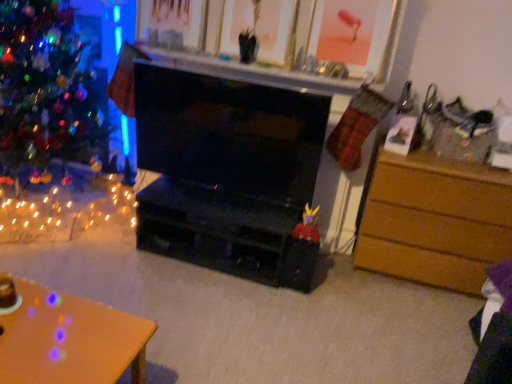
Where is `orange wood desk at lower left`? This screenshot has height=384, width=512. orange wood desk at lower left is located at coordinates (70, 340).

In order to click on black glossy fireplace at center in this screenshot , I will do `click(229, 133)`.

Describe the element at coordinates (47, 88) in the screenshot. I see `shiny multicolored ornaments at left` at that location.

Locate an element on the screen. Image resolution: width=512 pixels, height=384 pixels. orange wood desk at lower left is located at coordinates (70, 340).

In the scene shown: Does orange wood desk at lower left lie behind black glossy fireplace at center?

No, orange wood desk at lower left is in front of black glossy fireplace at center.

Is orange wood desk at lower left directly adjacent to black glossy fireplace at center?

No, orange wood desk at lower left is not next to black glossy fireplace at center.

Do you think orange wood desk at lower left is within black glossy fireplace at center, or outside of it?

orange wood desk at lower left is not enclosed by black glossy fireplace at center.

The width and height of the screenshot is (512, 384). What are the coordinates of `desk below the black glossy fireplace at center (from a real-world perspective)` in the screenshot? It's located at (70, 340).

Between point (438, 274) and point (148, 115), which one is positioned in front?

Point (148, 115)

From the image's perspective, which is below, brown wooden chest of drawers at right or black glossy fireplace at center?

brown wooden chest of drawers at right.

Which is more to the left, brown wooden chest of drawers at right or black glossy fireplace at center?

black glossy fireplace at center.

Can we say brown wooden chest of drawers at right lies outside black glossy fireplace at center?

brown wooden chest of drawers at right lies outside black glossy fireplace at center's area.

Identify the location of fireplace above the shiny multicolored ornaments at left (from a real-world perspective). This screenshot has width=512, height=384. (229, 133).

In the scene shown: Who is smaller, black glossy fireplace at center or shiny multicolored ornaments at left?

With smaller size is black glossy fireplace at center.

Does black glossy fireplace at center contain shiny multicolored ornaments at left?

Definitely not — shiny multicolored ornaments at left is not inside black glossy fireplace at center.

Is black glossy fireplace at center oriented towards shiny multicolored ornaments at left?

No, black glossy fireplace at center is not oriented towards shiny multicolored ornaments at left.

Is black glossy fireplace at center outside of orange wood desk at lower left?

Absolutely, black glossy fireplace at center is external to orange wood desk at lower left.

Find the location of a particular element. fireplace above the orange wood desk at lower left (from the image's perspective) is located at coordinates (229, 133).

Can you confirm if black glossy fireplace at center is bigger than orange wood desk at lower left?

Incorrect, black glossy fireplace at center is not larger than orange wood desk at lower left.

Does black glossy fireplace at center turn towards orange wood desk at lower left?

Yes, black glossy fireplace at center is turned towards orange wood desk at lower left.

Can you confirm if brown wooden chest of drawers at right is taller than shiny multicolored ornaments at left?

Incorrect, the height of brown wooden chest of drawers at right is not larger of that of shiny multicolored ornaments at left.

From the image's perspective, would you say brown wooden chest of drawers at right is shown under shiny multicolored ornaments at left?

Correct, brown wooden chest of drawers at right appears lower than shiny multicolored ornaments at left in the image.

Between brown wooden chest of drawers at right and shiny multicolored ornaments at left, which one appears on the right side from the viewer's perspective?

brown wooden chest of drawers at right.

How different are the orientations of brown wooden chest of drawers at right and shiny multicolored ornaments at left in degrees?

The facing directions of brown wooden chest of drawers at right and shiny multicolored ornaments at left are 0.597 degrees apart.

Between black glossy fireplace at center and brown wooden chest of drawers at right, which one appears on the left side from the viewer's perspective?

Positioned to the left is black glossy fireplace at center.

Is black glossy fireplace at center aimed at brown wooden chest of drawers at right?

No, black glossy fireplace at center is not oriented towards brown wooden chest of drawers at right.

From a real-world perspective, is black glossy fireplace at center on top of brown wooden chest of drawers at right?

Yes, from a real-world perspective, black glossy fireplace at center is over brown wooden chest of drawers at right

Is black glossy fireplace at center taller than brown wooden chest of drawers at right?

No, black glossy fireplace at center is not taller than brown wooden chest of drawers at right.

From a real-world perspective, who is located higher, brown wooden chest of drawers at right or orange wood desk at lower left?

brown wooden chest of drawers at right, from a real-world perspective.

From the picture: From the image's perspective, which is above, brown wooden chest of drawers at right or orange wood desk at lower left?

From the image's view, brown wooden chest of drawers at right is above.

Is brown wooden chest of drawers at right completely or partially outside of orange wood desk at lower left?

brown wooden chest of drawers at right lies outside orange wood desk at lower left's area.

Looking at this image, which of these two, brown wooden chest of drawers at right or orange wood desk at lower left, is wider?

orange wood desk at lower left.

Find the location of a particular element. desk located on the left of black glossy fireplace at center is located at coordinates (70, 340).

Identify the location of fireplace that appears in front of the brown wooden chest of drawers at right. (229, 133).

Considering their positions, is black glossy fireplace at center positioned closer to brown wooden chest of drawers at right than orange wood desk at lower left?

black glossy fireplace at center lies closer to brown wooden chest of drawers at right than the other object.

Based on their spatial positions, is shiny multicolored ornaments at left or brown wooden chest of drawers at right closer to black glossy fireplace at center?

brown wooden chest of drawers at right is closer to black glossy fireplace at center.

From the picture: Which object lies further to the anchor point brown wooden chest of drawers at right, shiny multicolored ornaments at left or orange wood desk at lower left?

shiny multicolored ornaments at left lies further to brown wooden chest of drawers at right than the other object.

Looking at the image, which one is located further to black glossy fireplace at center, orange wood desk at lower left or shiny multicolored ornaments at left?

The object further to black glossy fireplace at center is orange wood desk at lower left.

Looking at the image, which one is located further to brown wooden chest of drawers at right, orange wood desk at lower left or shiny multicolored ornaments at left?

shiny multicolored ornaments at left lies further to brown wooden chest of drawers at right than the other object.

Looking at the image, which one is located further to orange wood desk at lower left, brown wooden chest of drawers at right or black glossy fireplace at center?

brown wooden chest of drawers at right is positioned further to the anchor orange wood desk at lower left.

Estimate the real-world distances between objects in this image. Which object is closer to black glossy fireplace at center, brown wooden chest of drawers at right or shiny multicolored ornaments at left?

The object closer to black glossy fireplace at center is brown wooden chest of drawers at right.

Considering their positions, is orange wood desk at lower left positioned further to shiny multicolored ornaments at left than brown wooden chest of drawers at right?

brown wooden chest of drawers at right is further to shiny multicolored ornaments at left.

Where is `fireplace between shiny multicolored ornaments at left and brown wooden chest of drawers at right`? This screenshot has width=512, height=384. fireplace between shiny multicolored ornaments at left and brown wooden chest of drawers at right is located at coordinates (229, 133).

Locate an element on the screen. This screenshot has width=512, height=384. fireplace between orange wood desk at lower left and brown wooden chest of drawers at right is located at coordinates (229, 133).

At what (x,y) coordinates should I click in order to perform the action: click on desk between shiny multicolored ornaments at left and brown wooden chest of drawers at right in the horizontal direction. Please return your answer as a coordinate pair (x, y). Looking at the image, I should click on (70, 340).

Identify the location of desk between shiny multicolored ornaments at left and black glossy fireplace at center in the horizontal direction. (70, 340).